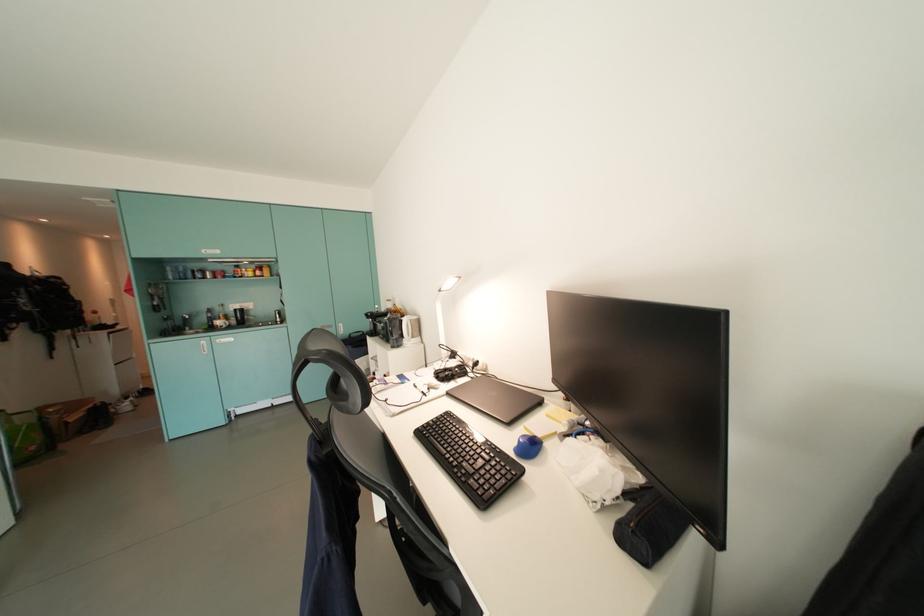
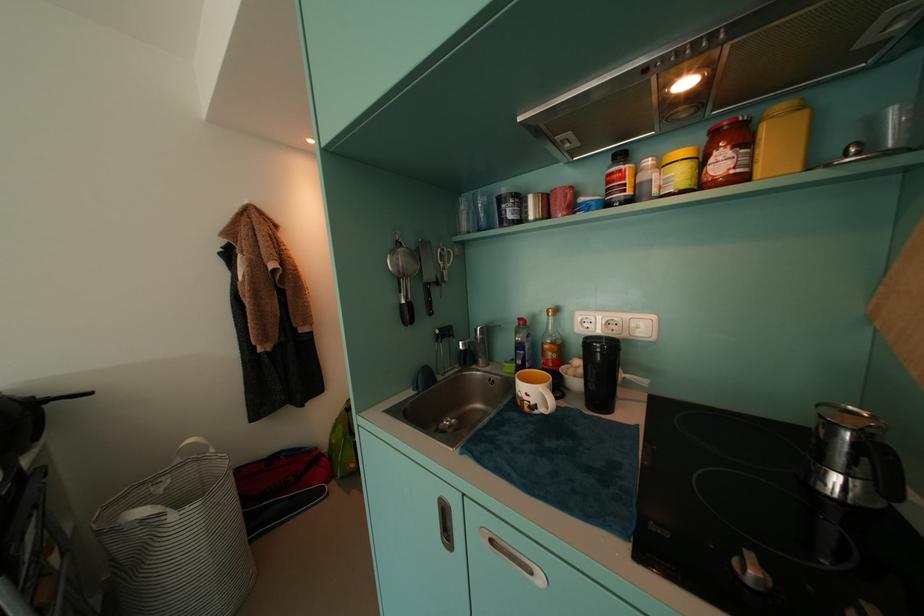
Find the pixel in the second image that matches the point at 265,276 in the first image.

(730, 166)